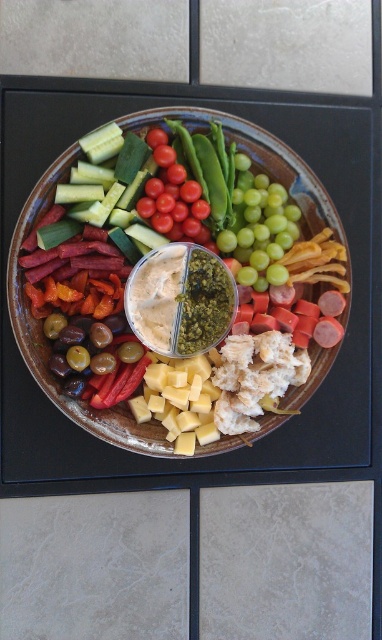
Question: Which is nearer to the brown ceramic platter at center?

Choices:
 (A) smooth creamy dip at center
 (B) red glossy cherry tomatoes at center
 (C) yellow cube cheese at center

Answer: (C)

Question: Which point appears closest to the camera in this image?

Choices:
 (A) click(184, 218)
 (B) click(173, 294)
 (C) click(134, 120)
 (D) click(145, 371)

Answer: (C)

Question: From the image, what is the correct spatial relationship of brown ceramic platter at center in relation to smooth creamy dip at center?

Choices:
 (A) above
 (B) below

Answer: (A)

Question: Which point is closer to the camera?

Choices:
 (A) (80, 412)
 (B) (192, 208)

Answer: (A)

Question: Is smooth creamy dip at center wider than red glossy cherry tomatoes at center?

Choices:
 (A) no
 (B) yes

Answer: (B)

Question: Does yellow cube cheese at center have a larger size compared to red glossy cherry tomatoes at center?

Choices:
 (A) yes
 (B) no

Answer: (B)